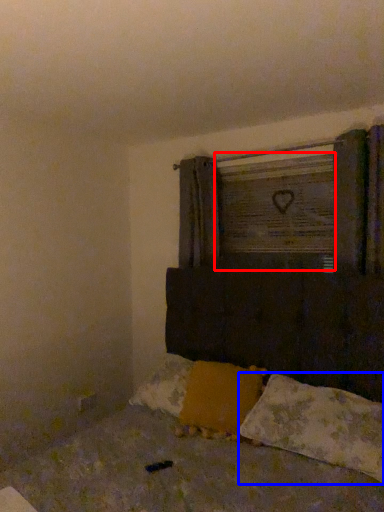
Question: Which point is closer to the camera, window frame (highlighted by a red box) or pillow (highlighted by a blue box)?

Choices:
 (A) window frame
 (B) pillow

Answer: (B)